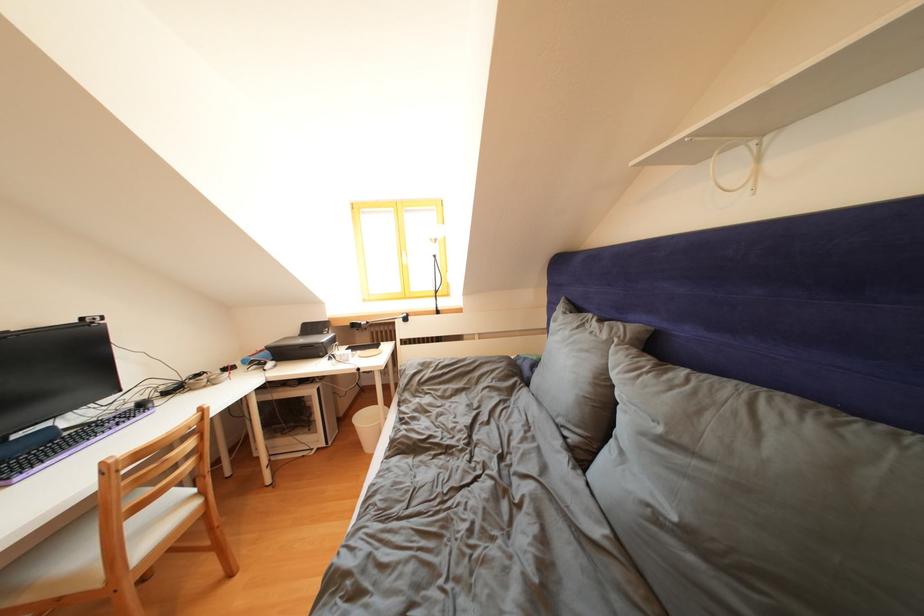
Describe the element at coordinates (91, 549) in the screenshot. I see `the chair sitting surface` at that location.